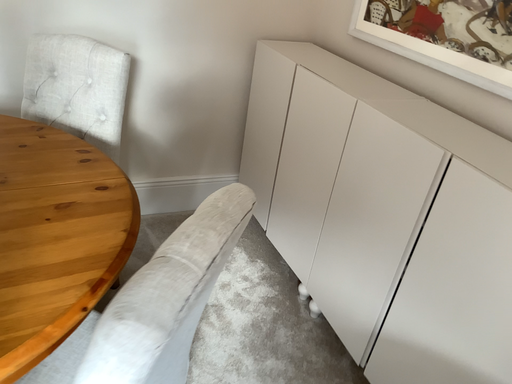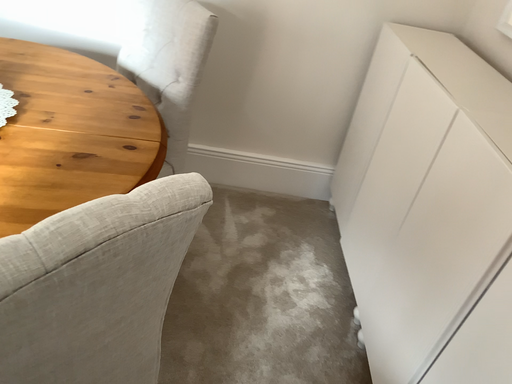
Question: How did the camera likely rotate when shooting the video?

Choices:
 (A) rotated right
 (B) rotated left

Answer: (B)